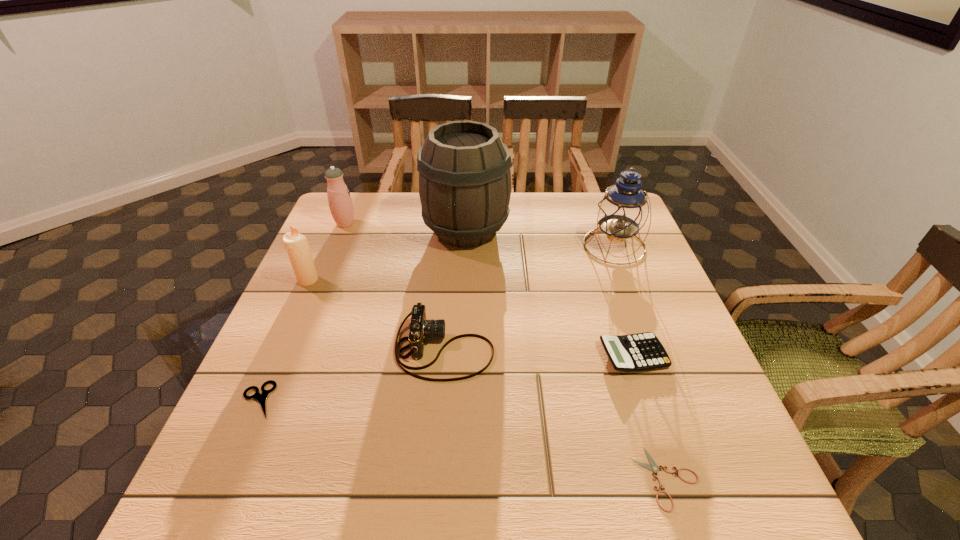
The height and width of the screenshot is (540, 960). I want to click on thermos bottle present at the far edge, so click(x=340, y=203).

You are a GUI agent. You are given a task and a screenshot of the screen. Output one action in this format:
    pyautogui.click(x=<x>, y=<y>)
    Task: Click on the object that is at the near edge
    The image size is (960, 540).
    Given the screenshot: What is the action you would take?
    pyautogui.click(x=653, y=467)

Where is `thermos bottle that is at the left edge`? This screenshot has width=960, height=540. thermos bottle that is at the left edge is located at coordinates (340, 203).

What are the coordinates of `candle that is at the left edge` in the screenshot? It's located at (296, 244).

Locate an element on the screen. shears located at the left edge is located at coordinates (261, 398).

Where is `lantern at the right edge`? The image size is (960, 540). lantern at the right edge is located at coordinates (622, 212).

This screenshot has width=960, height=540. What are the coordinates of `calculator present at the right edge` in the screenshot? It's located at (643, 351).

This screenshot has width=960, height=540. What are the coordinates of `shears that is at the right edge` in the screenshot? It's located at (653, 467).

This screenshot has height=540, width=960. I want to click on object present at the far left corner, so click(x=340, y=203).

Locate an element on the screen. Image resolution: width=960 pixels, height=540 pixels. object that is at the far right corner is located at coordinates (622, 212).